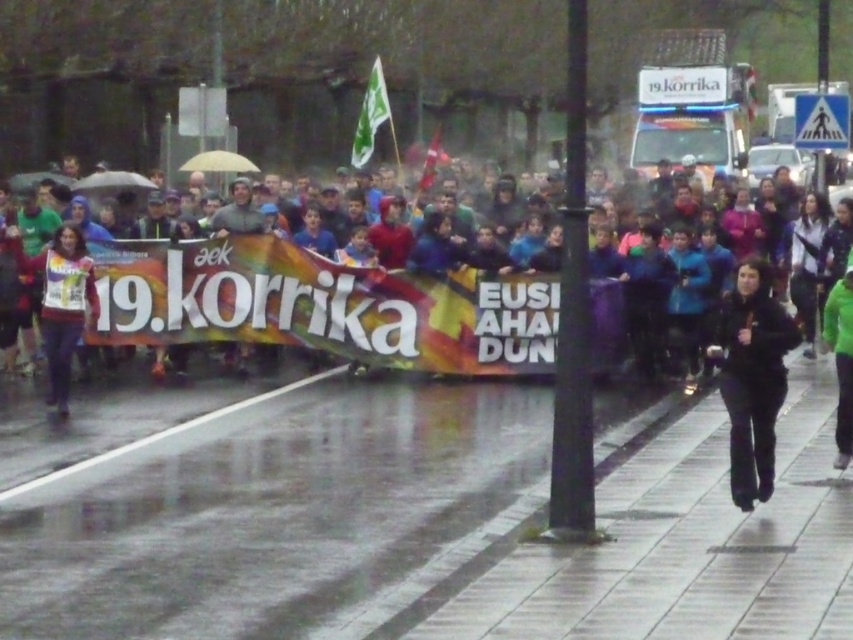
You are a photographer standing at the center of the scene. You want to capture a photo that includes both the black matte pants at lower right and the matte white shirt at left. What is the minimum distance you need to move to ensure both are in frame?

The black matte pants at lower right is 22.21 feet from the matte white shirt at left. To include both in the frame, you need to position yourself such that the camera can cover this distance. Assuming a standard camera field of view, you might need to move back until both are within the frame. However, without specific camera specifications, the minimum distance to move would depend on adjusting your position to encompass the 22.21 feet between them.

You are standing at the point labeled point (732, 440) and want to walk to point (67, 273). Which direction should you move to get closer to your destination?

You should move downward and to the left to reach point (67, 273) since it is located below and to the left of your current position at point (732, 440).

You are a photographer standing at the camera position. You want to take a photo of the matte white shirt at left without moving the shirt. Can you adjust your camera position to capture the entire shirt in the frame?

The matte white shirt at left and camera are 45.93 feet apart. Since the shirt is far away from the camera, you can adjust your camera position to zoom in or move closer to ensure the entire shirt fits in the frame.